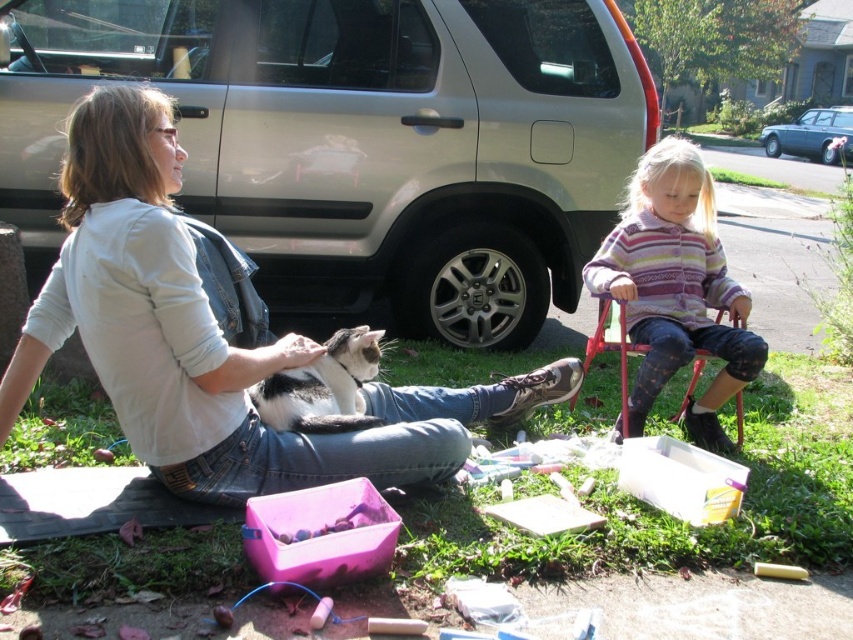
Is silver metallic suv at center wider than teal metallic sedan at upper right?

Yes, silver metallic suv at center is wider than teal metallic sedan at upper right.

Is point (437, 33) farther from viewer compared to point (778, 131)?

That is False.

Which is in front, point (172, 1) or point (822, 147)?

Point (172, 1) is in front.

Locate an element on the screen. silver metallic suv at center is located at coordinates (360, 140).

Does point (248, 456) come behind point (781, 125)?

No, it is not.

At what (x,y) coordinates should I click in order to perform the action: click on matte white shirt at center. Please return your answer as a coordinate pair (x, y). Looking at the image, I should click on (212, 333).

You are a GUI agent. You are given a task and a screenshot of the screen. Output one action in this format:
    pyautogui.click(x=<x>, y=<y>)
    Task: Click on the matte white shirt at center
    This screenshot has width=853, height=640.
    Given the screenshot: What is the action you would take?
    pyautogui.click(x=212, y=333)

Does silver metallic suv at center lie in front of gray-black fur cat at center?

No, silver metallic suv at center is behind gray-black fur cat at center.

Is point (41, 252) in front of point (285, 406)?

No.

Identify the location of silver metallic suv at center. The width and height of the screenshot is (853, 640). (360, 140).